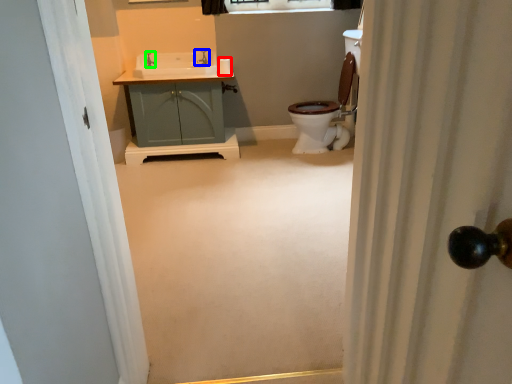
Question: Which object is the farthest from toilet paper (highlighted by a red box)? Choose among these: tap (highlighted by a blue box) or faucet (highlighted by a green box).

Choices:
 (A) tap
 (B) faucet

Answer: (B)